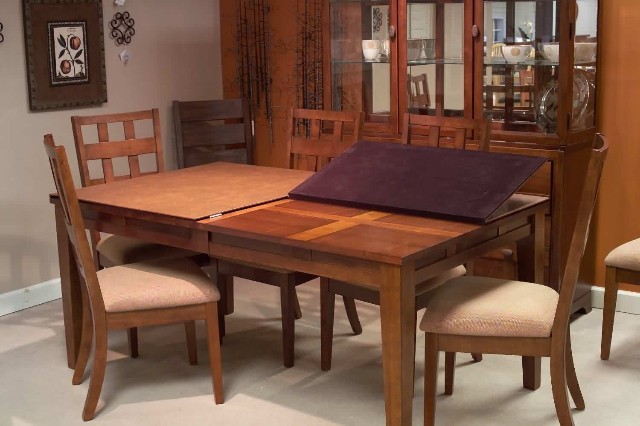
Where is `chair cushion`? chair cushion is located at coordinates (511, 299), (626, 254), (450, 277), (276, 271), (116, 245), (124, 282).